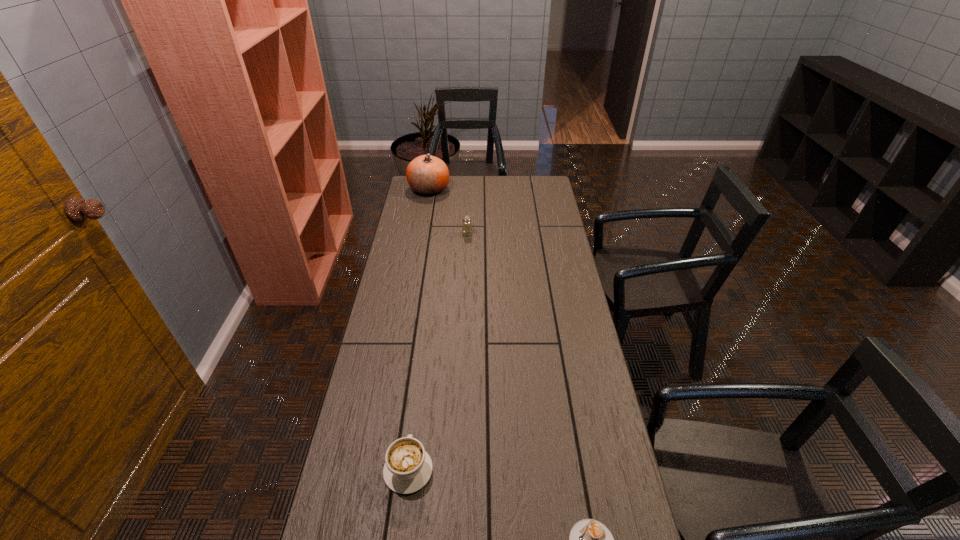
Identify the location of the farthest object. (428, 175).

Where is `pumpkin`? The width and height of the screenshot is (960, 540). pumpkin is located at coordinates (428, 175).

Locate an element on the screen. The width and height of the screenshot is (960, 540). the second farthest object is located at coordinates (466, 224).

Where is `the second object from right to left`? the second object from right to left is located at coordinates (466, 224).

Where is `the third farthest object`? This screenshot has width=960, height=540. the third farthest object is located at coordinates (408, 467).

Where is `the taller cappuccino`? The image size is (960, 540). the taller cappuccino is located at coordinates (408, 467).

Find the location of `free space located 0.090m on the right of the farthest object`. free space located 0.090m on the right of the farthest object is located at coordinates (468, 189).

At what (x,y) coordinates should I click in order to perform the action: click on free space located on the left of the second farthest object. Please return your answer as a coordinate pair (x, y). The width and height of the screenshot is (960, 540). Looking at the image, I should click on (422, 234).

Identify the location of free spot located to the right of the second nearest object's handle. The width and height of the screenshot is (960, 540). (420, 373).

This screenshot has height=540, width=960. Identify the location of vacant space located 0.350m to the right of the second nearest object's handle. (423, 349).